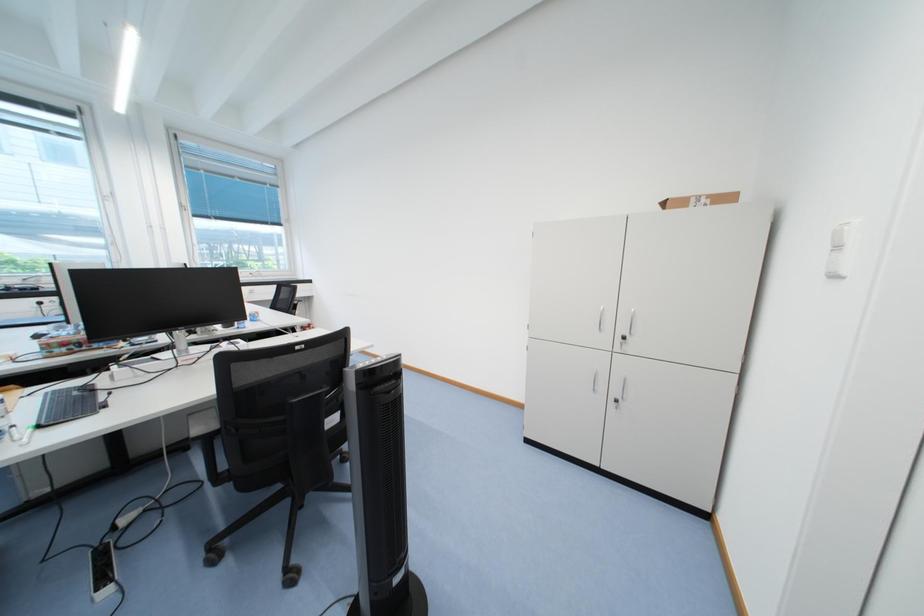
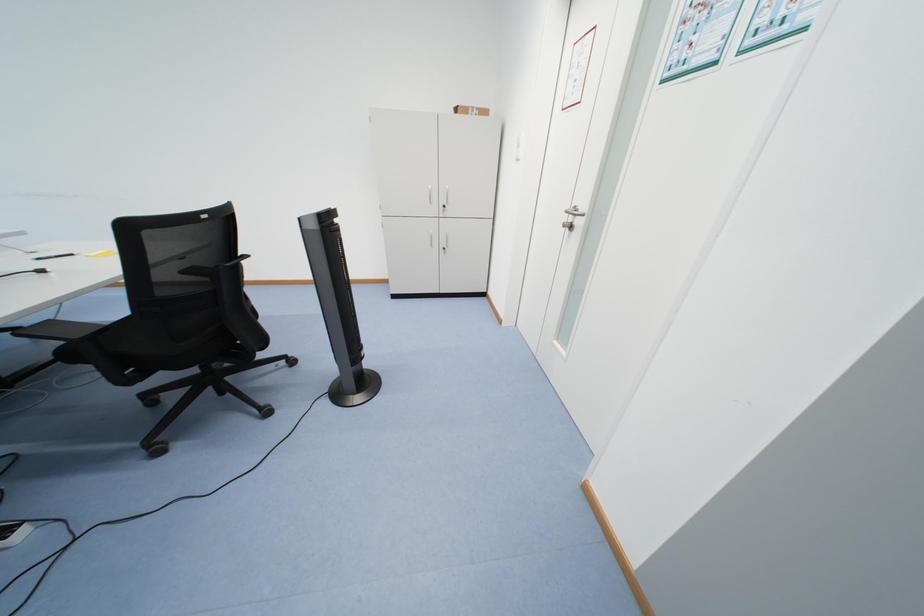
First-person continuous shooting, in which direction is the camera rotating?

The camera's rotation is toward right-down.